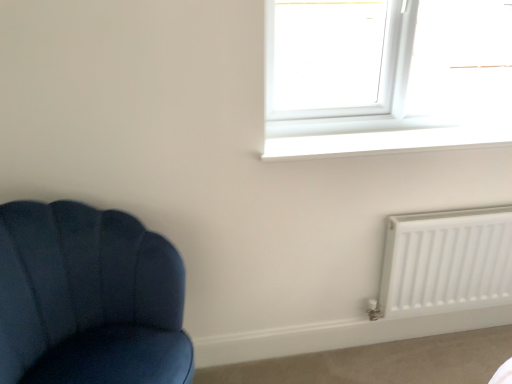
Question: Considering the relative positions of white plastic window at upper right and white smooth window sill at upper center in the image provided, is white plastic window at upper right to the left or to the right of white smooth window sill at upper center?

Choices:
 (A) right
 (B) left

Answer: (A)

Question: Considering the positions of white plastic window at upper right and white smooth window sill at upper center in the image, is white plastic window at upper right taller or shorter than white smooth window sill at upper center?

Choices:
 (A) short
 (B) tall

Answer: (B)

Question: Based on their relative distances, which object is nearer to the white matte radiator at lower right?

Choices:
 (A) white smooth window sill at upper center
 (B) velvet blue chair at left
 (C) white plastic window at upper right

Answer: (A)

Question: Which is nearer to the velvet blue chair at left?

Choices:
 (A) white matte radiator at lower right
 (B) white smooth window sill at upper center
 (C) white plastic window at upper right

Answer: (B)